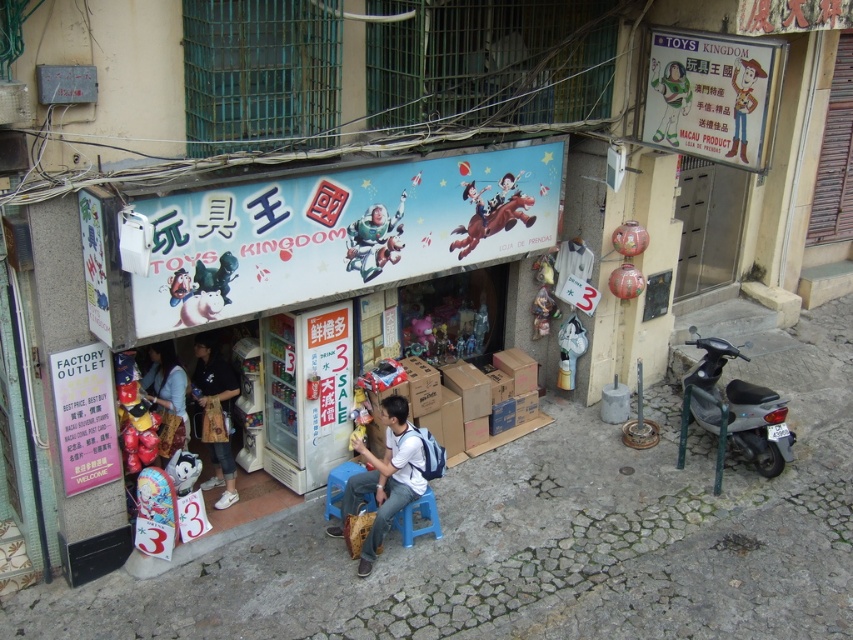
You are a customer in the toy shop looking for a spacesuit and a shirt. The shop assistant tells you that the white fabric shirt at center is to the right of the matte blue spacesuit at center. Can you locate both items based on their positions?

Yes, the white fabric shirt at center is located to the right of the matte blue spacesuit at center, so you can find the matte blue spacesuit at center first and then look to its right for the white fabric shirt at center.

Based on the photo, you are a customer in the toy shop and want to buy both the white fabric shirt at center and the matte blue spacesuit at center. The store has a shelf that can only hold items up to 1 meter in width. Can you place both items side by side on the shelf without exceeding the width limit?

The white fabric shirt at center might be wider than matte blue spacesuit at center, so it is uncertain if both can fit on the 1 meter shelf. Check their combined width first.

You are a customer in the toy shop and see two shirts displayed at the center. The white fabric shirt at center and the matte blue shirt at center. Which shirt is positioned to the right of the other?

The white fabric shirt at center is to the right of the matte blue shirt at center.